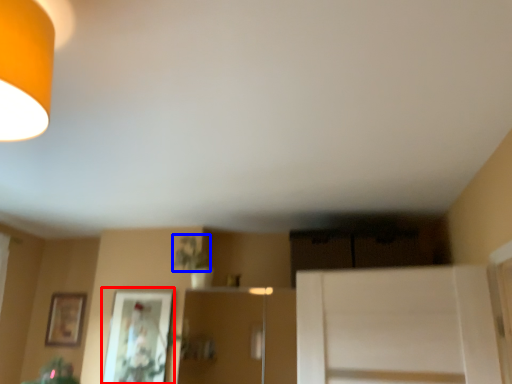
Question: Which point is closer to the camera, picture frame (highlighted by a red box) or plant (highlighted by a blue box)?

Choices:
 (A) picture frame
 (B) plant

Answer: (B)